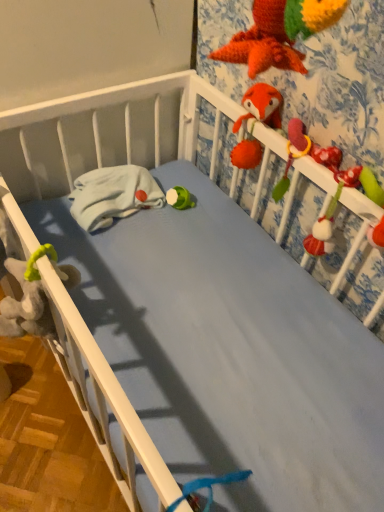
What do you see at coordinates (261, 106) in the screenshot?
I see `fluffy orange fox at upper right, placed as the 2th toy when sorted from right to left` at bounding box center [261, 106].

How much space does fluffy orange fox at upper right, placed as the 2th toy when sorted from right to left, occupy horizontally?

fluffy orange fox at upper right, placed as the 2th toy when sorted from right to left, is 6.98 centimeters wide.

The image size is (384, 512). Describe the element at coordinates (330, 215) in the screenshot. I see `soft plush toy at right, acting as the 1th toy starting from the bottom` at that location.

Locate an element on the screen. fuzzy red parrot at upper right is located at coordinates (304, 155).

Looking at this image, from the image's perspective, is fuzzy red parrot at upper right located above or below white matte crib rail at center?

fuzzy red parrot at upper right is above white matte crib rail at center.

From a real-world perspective, between fuzzy red parrot at upper right and white matte crib rail at center, who is vertically higher?

fuzzy red parrot at upper right is physically above.

Does fuzzy red parrot at upper right have a smaller size compared to white matte crib rail at center?

Yes.

Is fuzzy red parrot at upper right taller than white matte crib rail at center?

Yes.

Which object is further away from the camera, white matte crib rail at center or fluffy orange fox at upper right, which appears as the 1th toy when viewed from the top?

white matte crib rail at center is further away from the camera.

How many degrees apart are the facing directions of white matte crib rail at center and fluffy orange fox at upper right, the 1th toy viewed from the left?

87.5 degrees.

Is fluffy orange fox at upper right, the 1th toy viewed from the left, at the back of white matte crib rail at center?

That's not correct — white matte crib rail at center is not looking away from fluffy orange fox at upper right, the 1th toy viewed from the left.

From a real-world perspective, is white matte crib rail at center physically located above or below fluffy orange fox at upper right, placed as the 2th toy when sorted from right to left?

From a real-world perspective, white matte crib rail at center is physically below fluffy orange fox at upper right, placed as the 2th toy when sorted from right to left.

Is fluffy orange fox at upper right, positioned as the 2th toy in bottom-to-top order, not within soft plush toy at right, which is the first toy in right-to-left order?

Yes, fluffy orange fox at upper right, positioned as the 2th toy in bottom-to-top order, is located beyond the bounds of soft plush toy at right, which is the first toy in right-to-left order.

Is fluffy orange fox at upper right, positioned as the 2th toy in bottom-to-top order, facing towards soft plush toy at right, acting as the 1th toy starting from the bottom?

No, fluffy orange fox at upper right, positioned as the 2th toy in bottom-to-top order, is not facing towards soft plush toy at right, acting as the 1th toy starting from the bottom.

From a real-world perspective, which is physically below, fluffy orange fox at upper right, which appears as the 1th toy when viewed from the top, or soft plush toy at right, the second toy viewed from the left?

In real-world perspective, soft plush toy at right, the second toy viewed from the left, is lower.

Which object is further away from the camera taking this photo, fluffy orange fox at upper right, which appears as the 1th toy when viewed from the top, or soft plush toy at right, which is the first toy in right-to-left order?

Positioned behind is fluffy orange fox at upper right, which appears as the 1th toy when viewed from the top.

Is fluffy orange fox at upper right, the 1th toy viewed from the left, touching fuzzy red parrot at upper right?

fluffy orange fox at upper right, the 1th toy viewed from the left, and fuzzy red parrot at upper right are clearly separated.

Where is `parrot located in front of the fluffy orange fox at upper right, positioned as the 2th toy in bottom-to-top order`? The image size is (384, 512). parrot located in front of the fluffy orange fox at upper right, positioned as the 2th toy in bottom-to-top order is located at coordinates (304, 155).

From the image's perspective, is fluffy orange fox at upper right, positioned as the 2th toy in bottom-to-top order, positioned above or below fuzzy red parrot at upper right?

From the image's perspective, fluffy orange fox at upper right, positioned as the 2th toy in bottom-to-top order, appears above fuzzy red parrot at upper right.

Considering the relative sizes of fluffy orange fox at upper right, placed as the 2th toy when sorted from right to left, and fuzzy red parrot at upper right in the image provided, is fluffy orange fox at upper right, placed as the 2th toy when sorted from right to left, bigger than fuzzy red parrot at upper right?

Indeed, fluffy orange fox at upper right, placed as the 2th toy when sorted from right to left, has a larger size compared to fuzzy red parrot at upper right.

Is the depth of fuzzy red parrot at upper right greater than that of soft plush toy at right, acting as the 1th toy starting from the bottom?

Yes, the depth of fuzzy red parrot at upper right is greater than that of soft plush toy at right, acting as the 1th toy starting from the bottom.

Is fuzzy red parrot at upper right wider than soft plush toy at right, which is the first toy in right-to-left order?

Incorrect, the width of fuzzy red parrot at upper right does not surpass that of soft plush toy at right, which is the first toy in right-to-left order.

Is soft plush toy at right, the second toy viewed from the left, completely or partially inside fuzzy red parrot at upper right?

Definitely not — soft plush toy at right, the second toy viewed from the left, is not inside fuzzy red parrot at upper right.

How different are the orientations of fuzzy red parrot at upper right and soft plush toy at right, the 2th toy when ordered from top to bottom, in degrees?

fuzzy red parrot at upper right and soft plush toy at right, the 2th toy when ordered from top to bottom, are facing 4.45 degrees away from each other.

Is fluffy orange fox at upper right, the 1th toy viewed from the left, inside the boundaries of white matte crib rail at center, or outside?

fluffy orange fox at upper right, the 1th toy viewed from the left, is located beyond the bounds of white matte crib rail at center.

The width and height of the screenshot is (384, 512). I want to click on rail that is below the fluffy orange fox at upper right, placed as the 2th toy when sorted from right to left (from the image's perspective), so click(103, 397).

Is point (277, 117) farther from camera compared to point (137, 431)?

Yes, it is behind point (137, 431).

Is fluffy orange fox at upper right, which appears as the 1th toy when viewed from the top, aimed at white matte crib rail at center?

No, fluffy orange fox at upper right, which appears as the 1th toy when viewed from the top, is not oriented towards white matte crib rail at center.

Is white matte crib rail at center smaller than fuzzy red parrot at upper right?

Actually, white matte crib rail at center might be larger than fuzzy red parrot at upper right.

Considering the sizes of objects white matte crib rail at center and fuzzy red parrot at upper right in the image provided, who is taller, white matte crib rail at center or fuzzy red parrot at upper right?

fuzzy red parrot at upper right.

Who is more distant, white matte crib rail at center or fuzzy red parrot at upper right?

white matte crib rail at center is behind.

This screenshot has width=384, height=512. In order to click on rail that appears below the fuzzy red parrot at upper right (from a real-world perspective) in this screenshot , I will do `click(103, 397)`.

Identify the location of rail that appears on the left of fluffy orange fox at upper right, which appears as the 1th toy when viewed from the top. This screenshot has height=512, width=384. (103, 397).

Considering their positions, is white matte crib rail at center positioned further to fluffy orange fox at upper right, the 1th toy viewed from the left, than soft plush toy at right, acting as the 1th toy starting from the bottom?

white matte crib rail at center is positioned further to the anchor fluffy orange fox at upper right, the 1th toy viewed from the left.

Looking at the image, which one is located further to white matte crib rail at center, fluffy orange fox at upper right, which appears as the 1th toy when viewed from the top, or soft plush toy at right, acting as the 1th toy starting from the bottom?

fluffy orange fox at upper right, which appears as the 1th toy when viewed from the top, is further to white matte crib rail at center.

Estimate the real-world distances between objects in this image. Which object is closer to soft plush toy at right, which is the first toy in right-to-left order, fuzzy red parrot at upper right or fluffy orange fox at upper right, the 1th toy viewed from the left?

Among the two, fuzzy red parrot at upper right is located nearer to soft plush toy at right, which is the first toy in right-to-left order.

Looking at the image, which one is located closer to fuzzy red parrot at upper right, fluffy orange fox at upper right, which appears as the 1th toy when viewed from the top, or white matte crib rail at center?

Based on the image, fluffy orange fox at upper right, which appears as the 1th toy when viewed from the top, appears to be nearer to fuzzy red parrot at upper right.

Which object lies nearer to the anchor point soft plush toy at right, the second toy viewed from the left, fluffy orange fox at upper right, which appears as the 1th toy when viewed from the top, or white matte crib rail at center?

fluffy orange fox at upper right, which appears as the 1th toy when viewed from the top.

Looking at the image, which one is located further to fluffy orange fox at upper right, which appears as the 1th toy when viewed from the top, soft plush toy at right, the 2th toy when ordered from top to bottom, or fuzzy red parrot at upper right?

soft plush toy at right, the 2th toy when ordered from top to bottom, lies further to fluffy orange fox at upper right, which appears as the 1th toy when viewed from the top, than the other object.

Which object lies further to the anchor point fuzzy red parrot at upper right, soft plush toy at right, which is the first toy in right-to-left order, or fluffy orange fox at upper right, which appears as the 1th toy when viewed from the top?

Among the two, fluffy orange fox at upper right, which appears as the 1th toy when viewed from the top, is located further to fuzzy red parrot at upper right.

Estimate the real-world distances between objects in this image. Which object is further from fuzzy red parrot at upper right, fluffy orange fox at upper right, which appears as the 1th toy when viewed from the top, or soft plush toy at right, acting as the 1th toy starting from the bottom?

fluffy orange fox at upper right, which appears as the 1th toy when viewed from the top, is further to fuzzy red parrot at upper right.

I want to click on toy located between white matte crib rail at center and soft plush toy at right, acting as the 1th toy starting from the bottom, in the left-right direction, so (x=261, y=106).

This screenshot has width=384, height=512. I want to click on toy located between white matte crib rail at center and fuzzy red parrot at upper right in the left-right direction, so click(x=261, y=106).

Identify the location of parrot between fluffy orange fox at upper right, which appears as the 1th toy when viewed from the top, and soft plush toy at right, which is the first toy in right-to-left order, in the up-down direction. This screenshot has height=512, width=384. (304, 155).

This screenshot has width=384, height=512. What are the coordinates of `parrot located between white matte crib rail at center and soft plush toy at right, acting as the 1th toy starting from the bottom, in the left-right direction` in the screenshot? It's located at (304, 155).